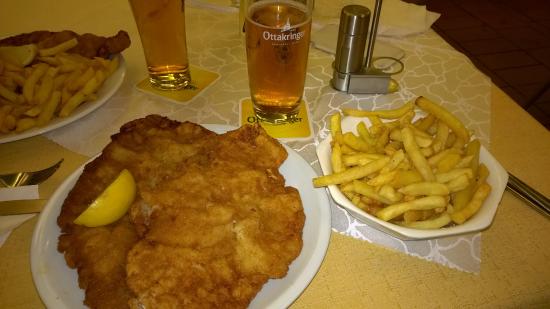
Locate an element on the screen. table mat is located at coordinates (473, 109).